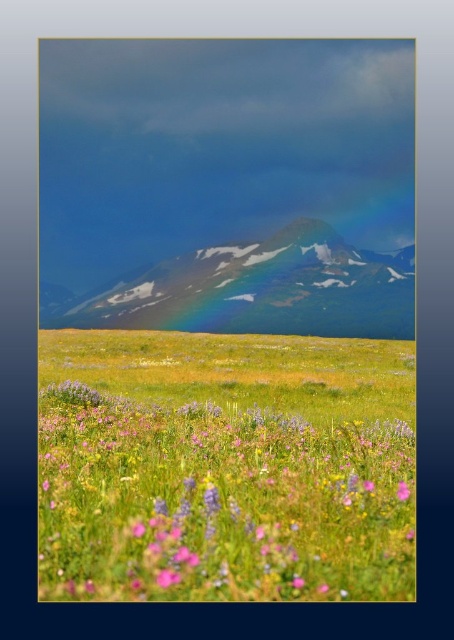
Question: Which of the following is the closest to the observer?

Choices:
 (A) pink matte flower at lower right
 (B) soft pink petals at center
 (C) sleek glassy mountain at center

Answer: (B)

Question: Does soft pink petals at center appear on the right side of sleek glassy mountain at center?

Choices:
 (A) yes
 (B) no

Answer: (B)

Question: Which point is closer to the camera?

Choices:
 (A) (300, 428)
 (B) (335, 244)

Answer: (A)

Question: Can you confirm if soft pink petals at center is wider than sleek glassy mountain at center?

Choices:
 (A) no
 (B) yes

Answer: (A)

Question: Estimate the real-world distances between objects in this image. Which object is farther from the pink matte flower at lower right?

Choices:
 (A) soft pink petals at center
 (B) sleek glassy mountain at center

Answer: (B)

Question: Is soft pink petals at center thinner than sleek glassy mountain at center?

Choices:
 (A) no
 (B) yes

Answer: (B)